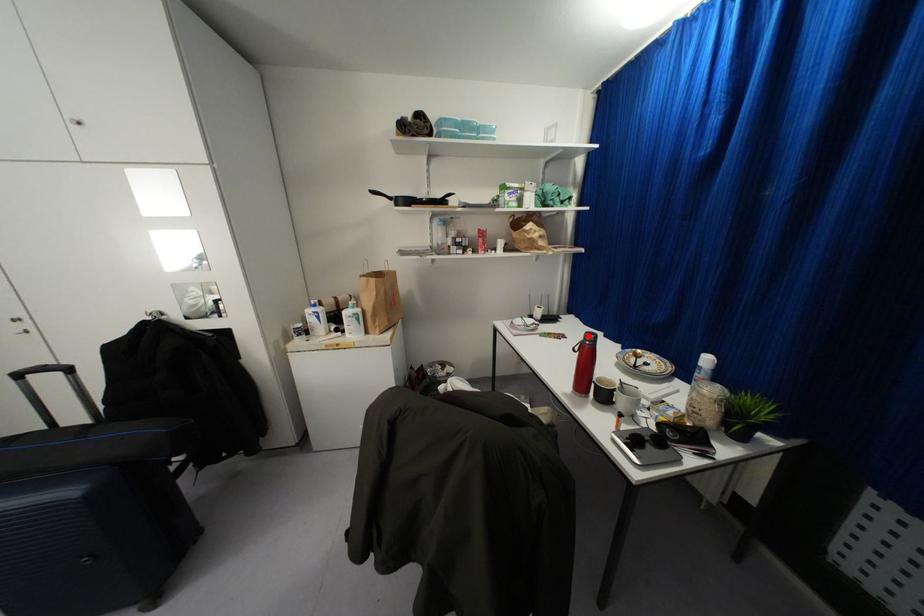
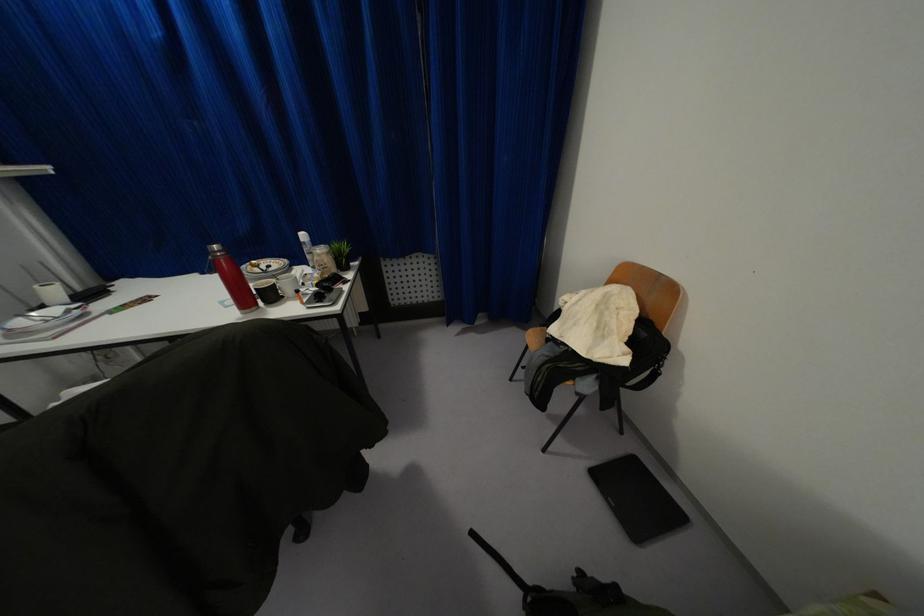
The point at the highlighted location is marked in the first image. Where is the corresponding point in the second image?

(214, 246)